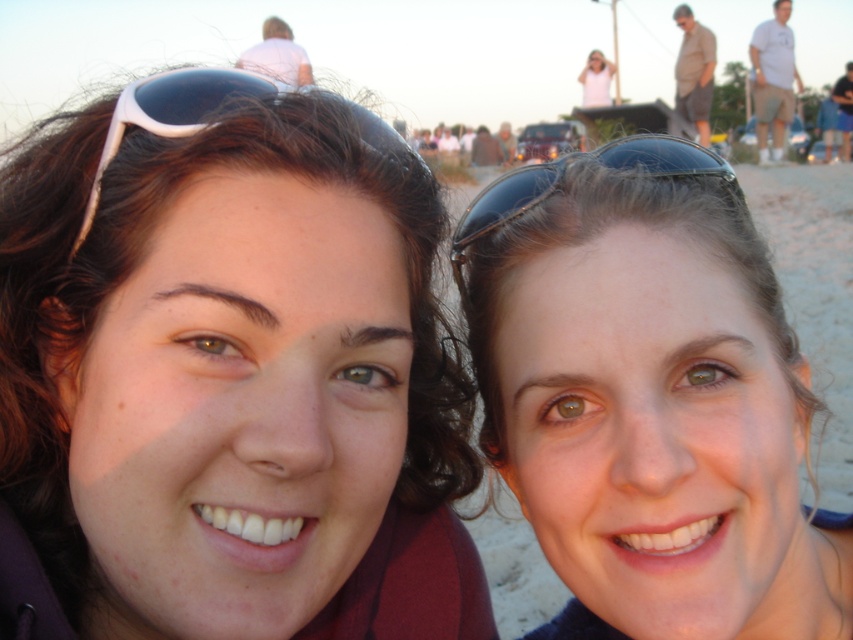
Question: Can you confirm if matte black sunglasses at upper left is positioned to the left of white cotton shirt at upper right?

Choices:
 (A) no
 (B) yes

Answer: (B)

Question: Can you confirm if matte black sunglasses at upper left is thinner than white plastic sunglasses at upper left?

Choices:
 (A) no
 (B) yes

Answer: (A)

Question: Considering the real-world distances, which object is farthest from the white plastic sunglasses at upper left?

Choices:
 (A) white cotton shirt at upper right
 (B) gray fabric shirt at upper right

Answer: (A)

Question: Which object is the closest to the matte black sunglasses at upper left?

Choices:
 (A) white cotton shirt at upper right
 (B) black matte sunglasses at upper center
 (C) gray fabric shirt at upper right
 (D) white plastic sunglasses at upper left

Answer: (D)

Question: Can you confirm if matte black sunglasses at upper left is positioned to the left of gray fabric shirt at upper right?

Choices:
 (A) yes
 (B) no

Answer: (A)

Question: Which object appears farthest from the camera in this image?

Choices:
 (A) gray fabric shirt at upper right
 (B) matte black sunglasses at upper left

Answer: (A)